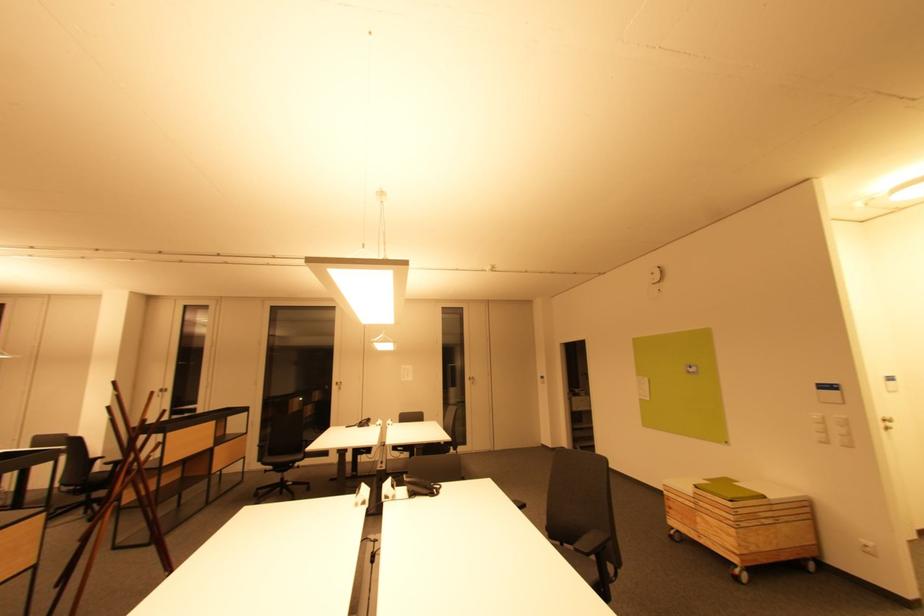
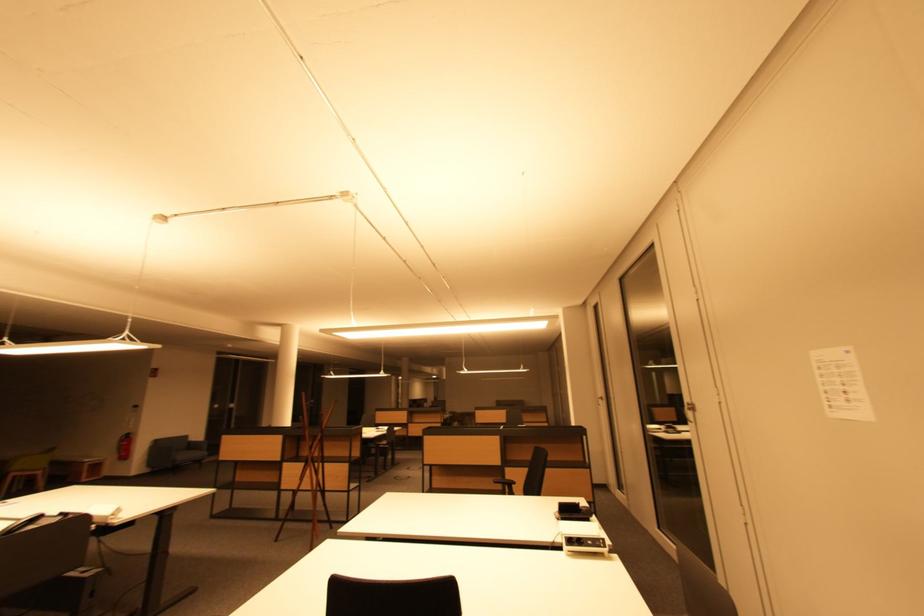
In the second image, find the point that corresponds to the point at 167,392 in the first image.

(605, 400)